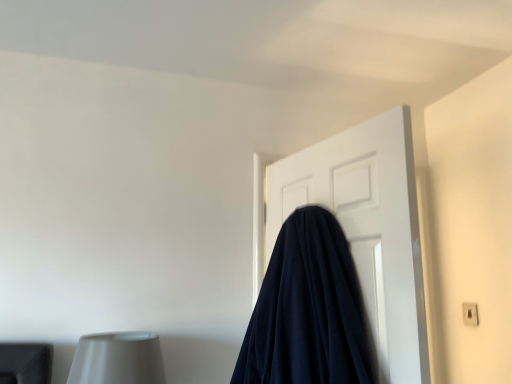
Question: Does white plastic electric outlet at upper right have a larger size compared to navy blue fabric at center?

Choices:
 (A) no
 (B) yes

Answer: (A)

Question: Does white plastic electric outlet at upper right have a greater width compared to navy blue fabric at center?

Choices:
 (A) no
 (B) yes

Answer: (A)

Question: Is there a large distance between white plastic electric outlet at upper right and navy blue fabric at center?

Choices:
 (A) yes
 (B) no

Answer: (B)

Question: Is white plastic electric outlet at upper right next to navy blue fabric at center?

Choices:
 (A) no
 (B) yes

Answer: (A)

Question: Does white plastic electric outlet at upper right contain navy blue fabric at center?

Choices:
 (A) no
 (B) yes

Answer: (A)

Question: Can you confirm if white plastic electric outlet at upper right is smaller than navy blue fabric at center?

Choices:
 (A) no
 (B) yes

Answer: (B)

Question: Can you confirm if navy blue fabric at center is thinner than navy blue fabric at center?

Choices:
 (A) no
 (B) yes

Answer: (B)

Question: From a real-world perspective, is navy blue fabric at center positioned over navy blue fabric at center based on gravity?

Choices:
 (A) no
 (B) yes

Answer: (B)

Question: Is navy blue fabric at center smaller than navy blue fabric at center?

Choices:
 (A) no
 (B) yes

Answer: (B)

Question: Can you confirm if navy blue fabric at center is bigger than navy blue fabric at center?

Choices:
 (A) no
 (B) yes

Answer: (A)

Question: Does navy blue fabric at center have a lesser height compared to navy blue fabric at center?

Choices:
 (A) yes
 (B) no

Answer: (B)

Question: Does navy blue fabric at center appear on the left side of navy blue fabric at center?

Choices:
 (A) yes
 (B) no

Answer: (B)

Question: From the image's perspective, is navy blue fabric at center on white plastic electric outlet at upper right?

Choices:
 (A) no
 (B) yes

Answer: (B)